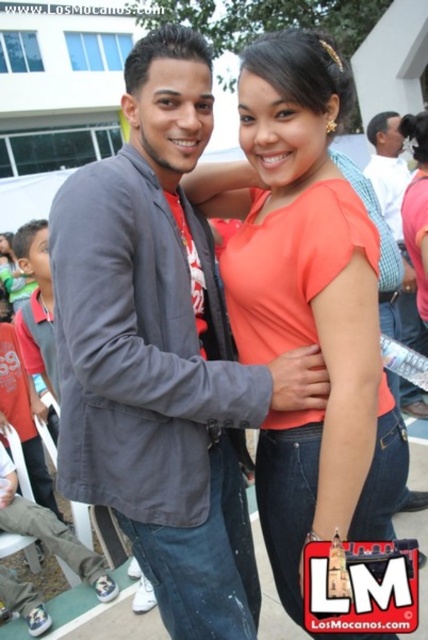
You are a photographer at the event and want to ensure both the matte orange blouse at center and the brushed metal shirt at center are clearly visible in your photo. Which one might appear more prominent in the photo due to its position?

The matte orange blouse at center is in front of the brushed metal shirt at center, so it will appear more prominent in the photo.

You are a photographer trying to frame a photo of the two people in the center wearing the matte gray blazer at center and the brushed metal shirt at center. Since you want to ensure both are fully visible, which clothing item should you focus on to adjust the framing?

The matte gray blazer at center is wider than the brushed metal shirt at center, so you should focus on the matte gray blazer at center to adjust the framing to ensure the wider item is fully captured.